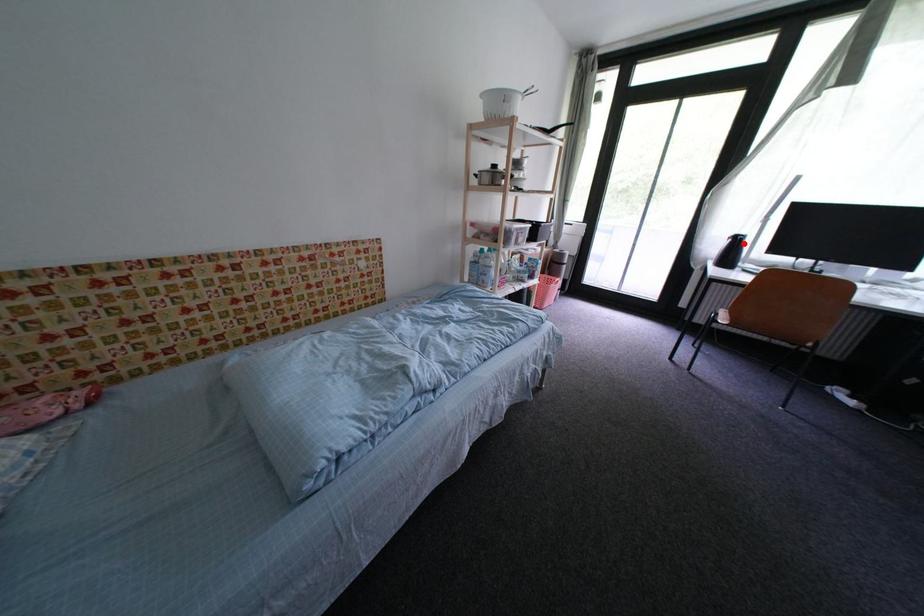
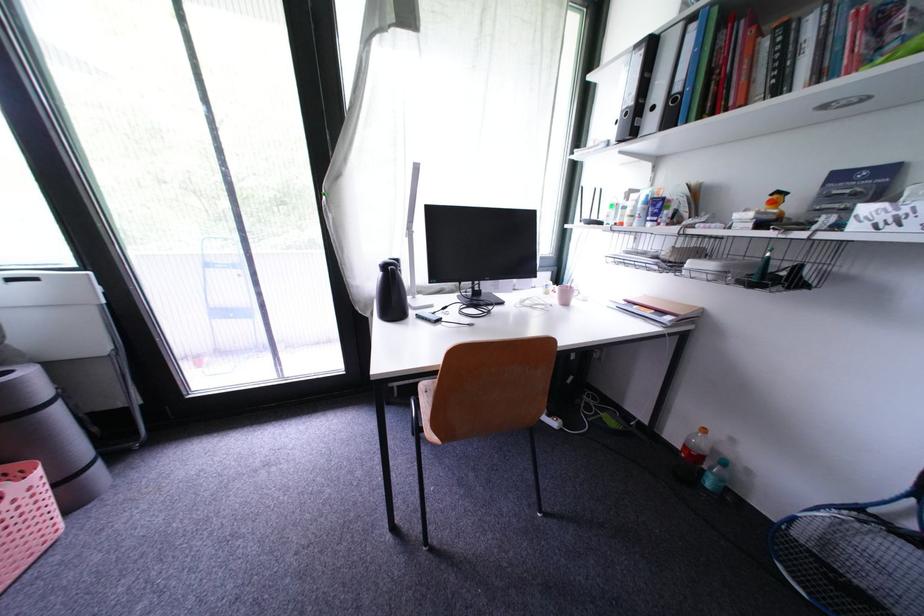
In the second image, find the point that corresponds to the highlighted location in the first image.

(398, 274)